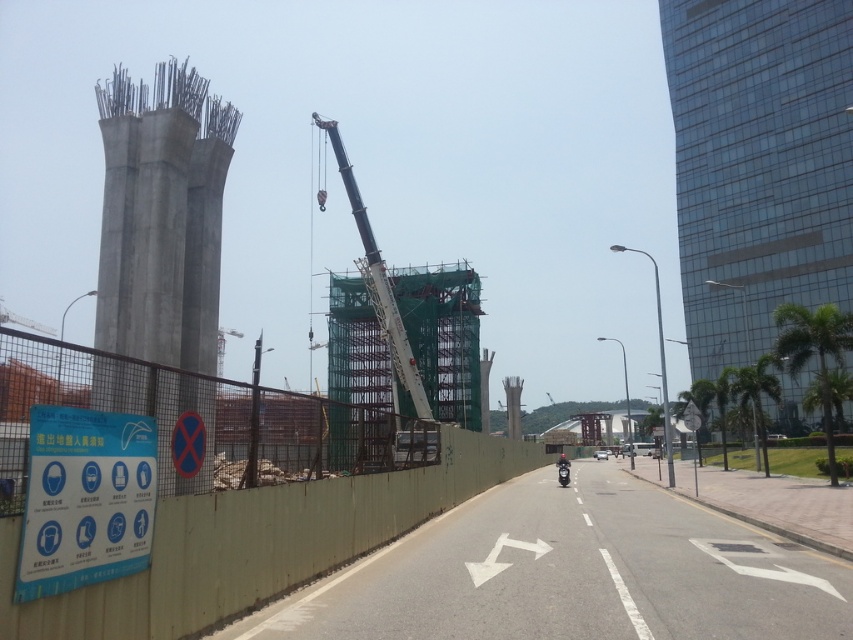
You are a delivery driver approaching the construction site. You need to drop off a package at the point marked by point (833, 22). However, there is an obstacle at point (70, 531). Can you safely navigate around the obstacle to reach your destination?

Point (833, 22) is behind point (70, 531), so you can safely navigate around the obstacle at point (70, 531) to reach the destination behind it.

You are a construction worker standing at the center of the construction site. You need to compare the heights of the glassy glass skyscraper at right and the concrete pillar at left. Which one is taller?

The glassy glass skyscraper at right is much taller than the concrete pillar at left according to the description.

You are a delivery person arriving at the construction site. You see the blue paper sign at lower left and the shiny black motorcycle at center. Which object is positioned higher from the ground?

The blue paper sign at lower left is located above the shiny black motorcycle at center, so the blue paper sign at lower left is higher from the ground.